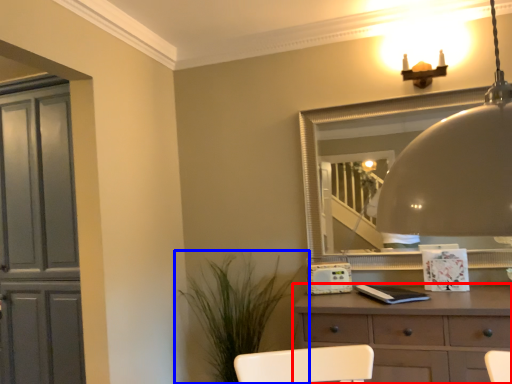
Question: Which object appears farthest to the camera in this image, chest of drawers (highlighted by a red box) or houseplant (highlighted by a blue box)?

Choices:
 (A) chest of drawers
 (B) houseplant

Answer: (B)